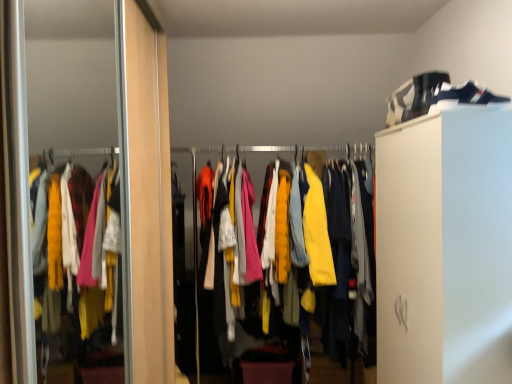
This screenshot has height=384, width=512. What do you see at coordinates (144, 196) in the screenshot? I see `wooden screen door at left` at bounding box center [144, 196].

Describe the element at coordinates (426, 90) in the screenshot. I see `camouflage fabric shoe at upper right` at that location.

The image size is (512, 384). Identify the location of wooden screen door at left. (144, 196).

From a real-world perspective, is camouflage fabric shoe at upper right on matte yellow jackets at center?

Yes, from a real-world perspective, camouflage fabric shoe at upper right is on top of matte yellow jackets at center.

Is camouflage fabric shoe at upper right positioned beyond the bounds of matte yellow jackets at center?

That's correct, camouflage fabric shoe at upper right is outside of matte yellow jackets at center.

Consider the image. Is camouflage fabric shoe at upper right placed right next to matte yellow jackets at center?

camouflage fabric shoe at upper right is not next to matte yellow jackets at center, and they're not touching.

Measure the distance between camouflage fabric shoe at upper right and matte yellow jackets at center.

They are 29.24 inches apart.

Is matte yellow jackets at center completely or partially outside of camouflage fabric shoe at upper right?

Absolutely, matte yellow jackets at center is external to camouflage fabric shoe at upper right.

Can you tell me how much matte yellow jackets at center and camouflage fabric shoe at upper right differ in facing direction?

The angle between the facing direction of matte yellow jackets at center and the facing direction of camouflage fabric shoe at upper right is 90.1 degrees.

From a real-world perspective, is matte yellow jackets at center physically below camouflage fabric shoe at upper right?

Yes, from a real-world perspective, matte yellow jackets at center is beneath camouflage fabric shoe at upper right.

From the image's perspective, relative to camouflage fabric shoe at upper right, is matte yellow jackets at center above or below?

Based on their image positions, matte yellow jackets at center is located beneath camouflage fabric shoe at upper right.

Who is more distant, camouflage fabric shoe at upper right or wooden screen door at left?

Positioned behind is camouflage fabric shoe at upper right.

Considering the positions of objects camouflage fabric shoe at upper right and wooden screen door at left in the image provided, who is more to the right, camouflage fabric shoe at upper right or wooden screen door at left?

camouflage fabric shoe at upper right is more to the right.

Does camouflage fabric shoe at upper right have a lesser height compared to wooden screen door at left?

Yes, camouflage fabric shoe at upper right is shorter than wooden screen door at left.

Considering the sizes of camouflage fabric shoe at upper right and wooden screen door at left in the image, is camouflage fabric shoe at upper right wider or thinner than wooden screen door at left?

In the image, camouflage fabric shoe at upper right appears to be more narrow than wooden screen door at left.

From a real-world perspective, is wooden screen door at left below camouflage fabric shoe at upper right?

Yes, from a real-world perspective, wooden screen door at left is below camouflage fabric shoe at upper right.

How different are the orientations of wooden screen door at left and camouflage fabric shoe at upper right in degrees?

180 degrees.

Is wooden screen door at left aimed at camouflage fabric shoe at upper right?

Yes, wooden screen door at left is oriented towards camouflage fabric shoe at upper right.

Is point (209, 150) closer or farther from the camera than point (117, 6)?

Clearly, point (209, 150) is more distant from the camera than point (117, 6).

Find the location of `screen door on the left side of matte yellow jackets at center`. screen door on the left side of matte yellow jackets at center is located at coordinates (144, 196).

How many degrees apart are the facing directions of matte yellow jackets at center and wooden screen door at left?

The angular difference between matte yellow jackets at center and wooden screen door at left is 89.5 degrees.

From the image's perspective, who appears lower, matte yellow jackets at center or wooden screen door at left?

matte yellow jackets at center, from the image's perspective.

Is wooden screen door at left next to matte yellow jackets at center and touching it?

No.

Is wooden screen door at left inside the boundaries of matte yellow jackets at center, or outside?

wooden screen door at left cannot be found inside matte yellow jackets at center.

Can you confirm if wooden screen door at left is positioned to the right of matte yellow jackets at center?

Incorrect, wooden screen door at left is not on the right side of matte yellow jackets at center.

Which of these two, wooden screen door at left or matte yellow jackets at center, is bigger?

matte yellow jackets at center.

The height and width of the screenshot is (384, 512). Identify the location of shoe above the matte yellow jackets at center (from the image's perspective). (426, 90).

At what (x,y) coordinates should I click in order to perform the action: click on closet below the camouflage fabric shoe at upper right (from a real-world perspective). Please return your answer as a coordinate pair (x, y). The image size is (512, 384). Looking at the image, I should click on point(335,152).

In the scene shown: Considering their positions, is camouflage fabric shoe at upper right positioned closer to wooden screen door at left than matte yellow jackets at center?

Among the two, matte yellow jackets at center is located nearer to wooden screen door at left.

From the image, which object appears to be farther from wooden screen door at left, matte yellow jackets at center or camouflage fabric shoe at upper right?

The object further to wooden screen door at left is camouflage fabric shoe at upper right.

Considering their positions, is wooden screen door at left positioned closer to matte yellow jackets at center than camouflage fabric shoe at upper right?

camouflage fabric shoe at upper right is closer to matte yellow jackets at center.

When comparing their distances from matte yellow jackets at center, does camouflage fabric shoe at upper right or wooden screen door at left seem closer?

camouflage fabric shoe at upper right is positioned closer to the anchor matte yellow jackets at center.

When comparing their distances from camouflage fabric shoe at upper right, does wooden screen door at left or matte yellow jackets at center seem closer?

The object closer to camouflage fabric shoe at upper right is matte yellow jackets at center.

From the image, which object appears to be nearer to camouflage fabric shoe at upper right, matte yellow jackets at center or wooden screen door at left?

matte yellow jackets at center is positioned closer to the anchor camouflage fabric shoe at upper right.

Where is `shoe between wooden screen door at left and matte yellow jackets at center along the z-axis`? This screenshot has width=512, height=384. shoe between wooden screen door at left and matte yellow jackets at center along the z-axis is located at coordinates (426, 90).